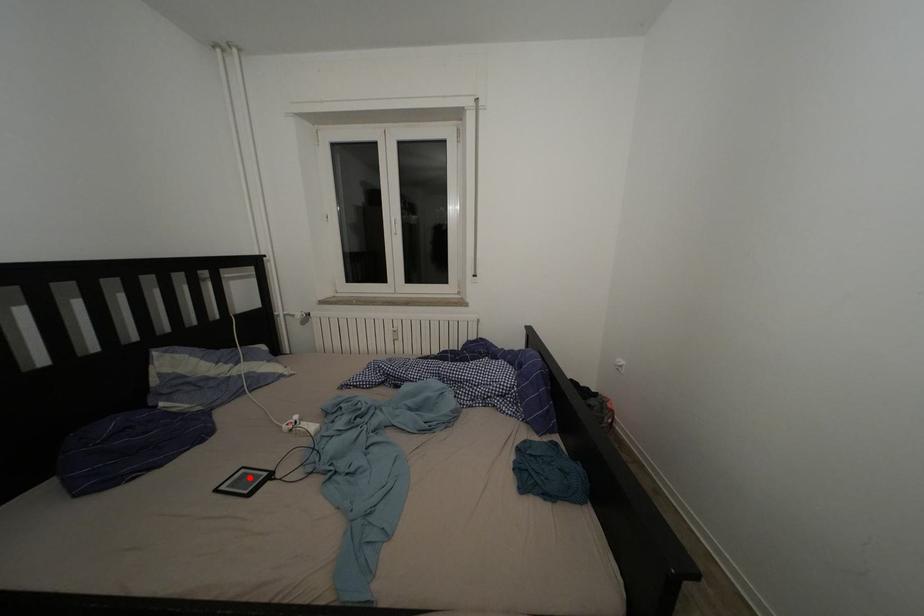
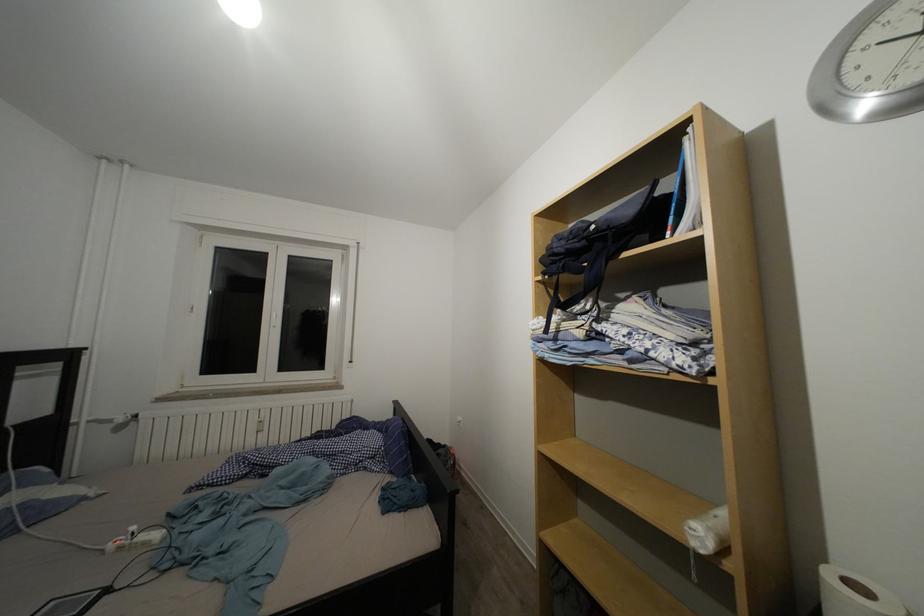
In the second image, find the point that corresponds to the highlighted location in the first image.

(61, 610)